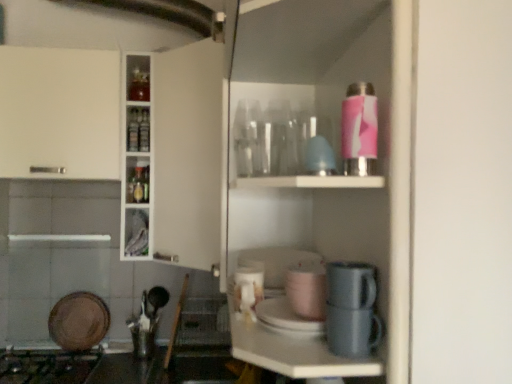
This screenshot has height=384, width=512. Describe the element at coordinates (352, 309) in the screenshot. I see `metallic gray coffee machine at lower center` at that location.

Where is `matte pink cup at center, positioned as the second appliance in front-to-back order`? matte pink cup at center, positioned as the second appliance in front-to-back order is located at coordinates (307, 289).

In the scene shown: Can you tell me how much matte pink cup at center, positioned as the second appliance in front-to-back order, and metallic gray coffee machine at lower center differ in facing direction?

1.03 degrees.

Between matte pink cup at center, positioned as the second appliance in front-to-back order, and metallic gray coffee machine at lower center, which one is positioned in front?

metallic gray coffee machine at lower center is closer to the camera.

Does matte pink cup at center, which is counted as the 2th appliance, starting from the right, have a lesser width compared to metallic gray coffee machine at lower center?

Incorrect, the width of matte pink cup at center, which is counted as the 2th appliance, starting from the right, is not less than that of metallic gray coffee machine at lower center.

From a real-world perspective, is matte pink cup at center, positioned as the second appliance in top-to-bottom order, positioned above or below metallic gray coffee machine at lower center?

In terms of real-world spatial position, matte pink cup at center, positioned as the second appliance in top-to-bottom order, is above metallic gray coffee machine at lower center.

Which point is more distant from viewer, [247,275] or [69,359]?

Point [69,359]

Do you think white glossy cup at center, placed as the 2th appliance when sorted from bottom to top, is within black matte gas stove at lower left, or outside of it?

The correct answer is: outside.

Considering the relative sizes of white glossy cup at center, the second appliance positioned from the back, and black matte gas stove at lower left in the image provided, is white glossy cup at center, the second appliance positioned from the back, bigger than black matte gas stove at lower left?

No.

Who is shorter, brown matte plate at lower left, the 1th appliance when ordered from left to right, or white glossy cup at center, which is counted as the third appliance, starting from the right?

Standing shorter between the two is white glossy cup at center, which is counted as the third appliance, starting from the right.

Can you confirm if brown matte plate at lower left, the fourth appliance in the front-to-back sequence, is positioned to the right of white glossy cup at center, which is counted as the third appliance, starting from the right?

In fact, brown matte plate at lower left, the fourth appliance in the front-to-back sequence, is to the left of white glossy cup at center, which is counted as the third appliance, starting from the right.

From the image's perspective, is brown matte plate at lower left, arranged as the fourth appliance when viewed from the right, positioned above or below white glossy cup at center, which is counted as the third appliance, starting from the top?

Clearly, from the image's perspective, brown matte plate at lower left, arranged as the fourth appliance when viewed from the right, is below white glossy cup at center, which is counted as the third appliance, starting from the top.

Can you see brown matte plate at lower left, arranged as the fourth appliance when viewed from the right, touching white glossy cup at center, placed as the 2th appliance when sorted from bottom to top?

They are not placed beside each other.

Does black matte gas stove at lower left have a smaller size compared to matte gray mug at lower center, which is the fourth appliance in left-to-right order?

Incorrect, black matte gas stove at lower left is not smaller in size than matte gray mug at lower center, which is the fourth appliance in left-to-right order.

From the image's perspective, which one is positioned higher, black matte gas stove at lower left or matte gray mug at lower center, which is the fourth appliance in left-to-right order?

matte gray mug at lower center, which is the fourth appliance in left-to-right order, from the image's perspective.

Which point is more distant from viewer, (40, 373) or (362, 292)?

Point (40, 373)

Locate an element on the screen. This screenshot has width=512, height=384. gas stove behind the matte gray mug at lower center, which is the fourth appliance in left-to-right order is located at coordinates (47, 366).

Is black matte gas stove at lower left wider or thinner than white glossy cup at center, which is counted as the third appliance, starting from the top?

Considering their sizes, black matte gas stove at lower left looks broader than white glossy cup at center, which is counted as the third appliance, starting from the top.

From a real-world perspective, who is located higher, black matte gas stove at lower left or white glossy cup at center, placed as the 2th appliance when sorted from bottom to top?

In real-world perspective, white glossy cup at center, placed as the 2th appliance when sorted from bottom to top, is above.

Who is smaller, black matte gas stove at lower left or white glossy cup at center, which is counted as the third appliance, starting from the right?

With smaller size is white glossy cup at center, which is counted as the third appliance, starting from the right.

Between black matte gas stove at lower left and white glossy cup at center, arranged as the second appliance when viewed from the left, which one has less height?

With less height is white glossy cup at center, arranged as the second appliance when viewed from the left.

Is brown matte plate at lower left, arranged as the fourth appliance when viewed from the right, positioned beyond the bounds of matte pink cup at center, marked as the third appliance in a bottom-to-top arrangement?

Yes, brown matte plate at lower left, arranged as the fourth appliance when viewed from the right, is located beyond the bounds of matte pink cup at center, marked as the third appliance in a bottom-to-top arrangement.

Who is taller, brown matte plate at lower left, the 1th appliance when ordered from left to right, or matte pink cup at center, positioned as the second appliance in front-to-back order?

brown matte plate at lower left, the 1th appliance when ordered from left to right, is taller.

Is brown matte plate at lower left, the 1th appliance when ordered from left to right, thinner than matte pink cup at center, marked as the third appliance in a bottom-to-top arrangement?

Yes, brown matte plate at lower left, the 1th appliance when ordered from left to right, is thinner than matte pink cup at center, marked as the third appliance in a bottom-to-top arrangement.

Consider the image. Measure the distance between brown matte plate at lower left, which is counted as the 1th appliance, starting from the back, and matte pink cup at center, positioned as the second appliance in top-to-bottom order.

They are 4.99 feet apart.

Can matte gray mug at lower center, which is counted as the 4th appliance, starting from the back, be found inside white glossy cup at center, placed as the 2th appliance when sorted from bottom to top?

No, matte gray mug at lower center, which is counted as the 4th appliance, starting from the back, is not surrounded by white glossy cup at center, placed as the 2th appliance when sorted from bottom to top.

Considering the positions of objects white glossy cup at center, acting as the 3th appliance starting from the front, and matte gray mug at lower center, which is the fourth appliance in left-to-right order, in the image provided, who is more to the left, white glossy cup at center, acting as the 3th appliance starting from the front, or matte gray mug at lower center, which is the fourth appliance in left-to-right order,?

From the viewer's perspective, white glossy cup at center, acting as the 3th appliance starting from the front, appears more on the left side.

Is white glossy cup at center, acting as the 3th appliance starting from the front, next to matte gray mug at lower center, placed as the first appliance when sorted from top to bottom?

white glossy cup at center, acting as the 3th appliance starting from the front, and matte gray mug at lower center, placed as the first appliance when sorted from top to bottom, are not in contact.

Looking at this image, which object is further away from the camera, white glossy cup at center, placed as the 2th appliance when sorted from bottom to top, or matte gray mug at lower center, the first appliance from the right?

white glossy cup at center, placed as the 2th appliance when sorted from bottom to top, is behind.

Locate an element on the screen. The image size is (512, 384). appliance that is the 1st one when counting backward from the metallic gray coffee machine at lower center is located at coordinates (307, 289).

The height and width of the screenshot is (384, 512). In the image, there is a white glossy cup at center, arranged as the second appliance when viewed from the left. Identify the location of gas stove below it (from a real-world perspective). (47, 366).

Which object lies further to the anchor point metallic gray coffee machine at lower center, brown matte plate at lower left, the 1th appliance in the bottom-to-top sequence, or matte pink cup at center, positioned as the second appliance in top-to-bottom order?

Among the two, brown matte plate at lower left, the 1th appliance in the bottom-to-top sequence, is located further to metallic gray coffee machine at lower center.

Based on their spatial positions, is matte gray mug at lower center, placed as the first appliance when sorted from top to bottom, or black matte gas stove at lower left further from metallic gray coffee machine at lower center?

black matte gas stove at lower left is further to metallic gray coffee machine at lower center.

Based on their spatial positions, is matte pink cup at center, positioned as the second appliance in front-to-back order, or black matte gas stove at lower left closer to brown matte plate at lower left, the 1th appliance when ordered from left to right?

black matte gas stove at lower left lies closer to brown matte plate at lower left, the 1th appliance when ordered from left to right, than the other object.

Which object lies further to the anchor point white glossy cup at center, the second appliance positioned from the back, matte pink cup at center, positioned as the second appliance in top-to-bottom order, or metallic gray coffee machine at lower center?

metallic gray coffee machine at lower center lies further to white glossy cup at center, the second appliance positioned from the back, than the other object.

When comparing their distances from brown matte plate at lower left, arranged as the fourth appliance when viewed from the right, does metallic gray coffee machine at lower center or matte gray mug at lower center, the first appliance from the right, seem further?

matte gray mug at lower center, the first appliance from the right.

Estimate the real-world distances between objects in this image. Which object is closer to brown matte plate at lower left, which is counted as the 1th appliance, starting from the back, matte pink cup at center, marked as the third appliance in a bottom-to-top arrangement, or white glossy cup at center, which is counted as the third appliance, starting from the top?

white glossy cup at center, which is counted as the third appliance, starting from the top, is closer to brown matte plate at lower left, which is counted as the 1th appliance, starting from the back.

When comparing their distances from matte gray mug at lower center, placed as the first appliance when sorted from top to bottom, does matte pink cup at center, which is counted as the 2th appliance, starting from the right, or white glossy cup at center, which is counted as the third appliance, starting from the right, seem closer?

matte pink cup at center, which is counted as the 2th appliance, starting from the right, lies closer to matte gray mug at lower center, placed as the first appliance when sorted from top to bottom, than the other object.

Looking at this image, from the image, which object appears to be farther from white glossy cup at center, acting as the 3th appliance starting from the front, brown matte plate at lower left, placed as the fourth appliance when sorted from top to bottom, or black matte gas stove at lower left?

The object further to white glossy cup at center, acting as the 3th appliance starting from the front, is brown matte plate at lower left, placed as the fourth appliance when sorted from top to bottom.

I want to click on gas stove between metallic gray coffee machine at lower center and brown matte plate at lower left, the 1th appliance when ordered from left to right, from front to back, so click(x=47, y=366).

At what (x,y) coordinates should I click in order to perform the action: click on gas stove between matte gray mug at lower center, which is the fourth appliance in left-to-right order, and brown matte plate at lower left, the 1th appliance in the bottom-to-top sequence, from front to back. Please return your answer as a coordinate pair (x, y). The height and width of the screenshot is (384, 512). Looking at the image, I should click on (47, 366).

At what (x,y) coordinates should I click in order to perform the action: click on appliance between matte gray mug at lower center, which is the 4th appliance from bottom to top, and white glossy cup at center, which is counted as the third appliance, starting from the top, in the front-back direction. Please return your answer as a coordinate pair (x, y). The width and height of the screenshot is (512, 384). Looking at the image, I should click on [307, 289].

The height and width of the screenshot is (384, 512). Identify the location of coffee machine between matte gray mug at lower center, which is the fourth appliance in left-to-right order, and white glossy cup at center, which is counted as the third appliance, starting from the top, in the front-back direction. (352, 309).